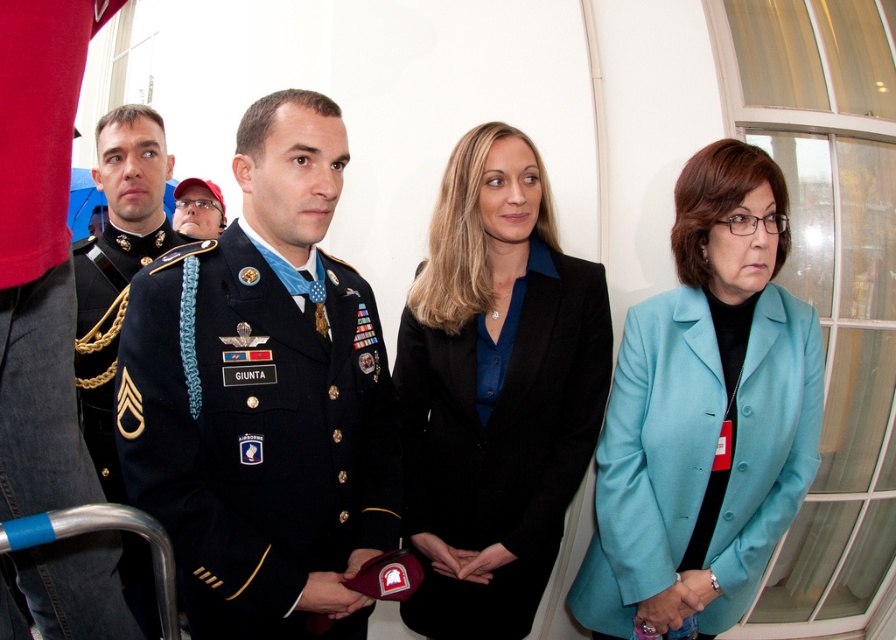
You are a photographer at a formal event. You need to capture a clear photo of the shiny black uniform at center and the black smooth blazer at center. Which object is positioned closer to the camera?

The shiny black uniform at center is closer to the viewer than the black smooth blazer at center, so the shiny black uniform at center will be closer to the camera.

You are a photographer positioned in front of the shiny black uniform at center. You want to capture a closeup shot without moving your camera. Can you do it given the distance?

The shiny black uniform at center is 33.92 inches away from viewer, so yes, the photographer can capture a closeup shot without moving the camera as the distance is within a typical closeup range.